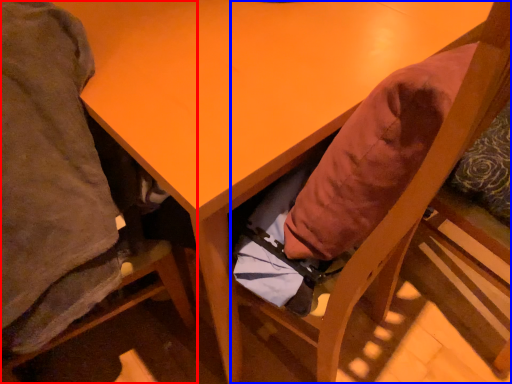
Question: Which of the following is the closest to the observer, chair (highlighted by a red box) or chair (highlighted by a blue box)?

Choices:
 (A) chair
 (B) chair

Answer: (A)